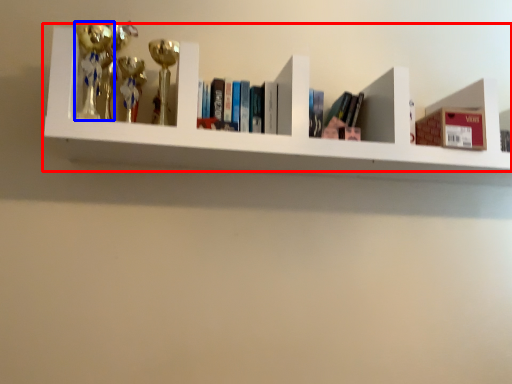
Question: Among these objects, which one is farthest to the camera, shelf (highlighted by a red box) or toy (highlighted by a blue box)?

Choices:
 (A) shelf
 (B) toy

Answer: (B)